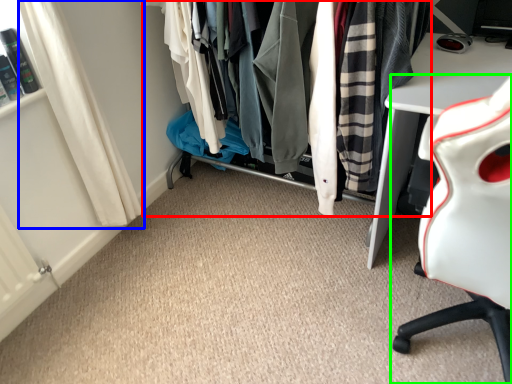
Question: Which is farther away from closet (highlighted by a red box)? curtain (highlighted by a blue box) or chair (highlighted by a green box)?

Choices:
 (A) curtain
 (B) chair

Answer: (A)